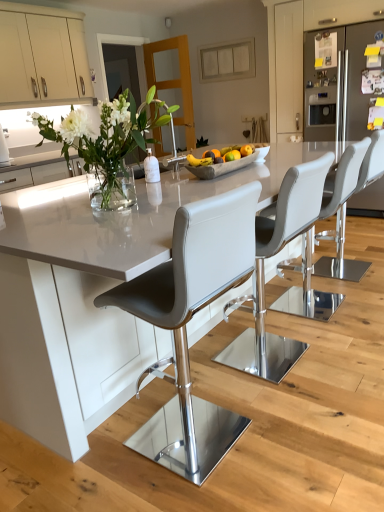
The width and height of the screenshot is (384, 512). In order to click on vacant area that is in front of white leather bar stool at center, which is the second chair in front-to-back order in this screenshot , I will do `click(297, 407)`.